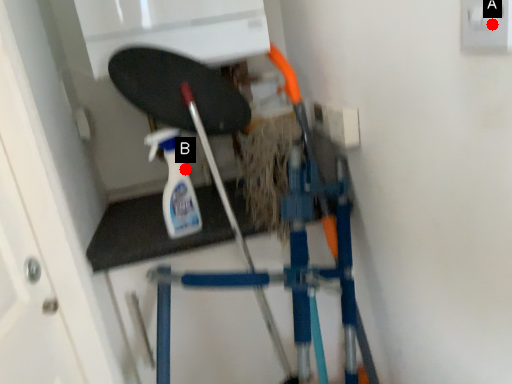
Question: Two points are circled on the image, labeled by A and B beside each circle. Which point appears closest to the camera in this image?

Choices:
 (A) A is closer
 (B) B is closer

Answer: (A)